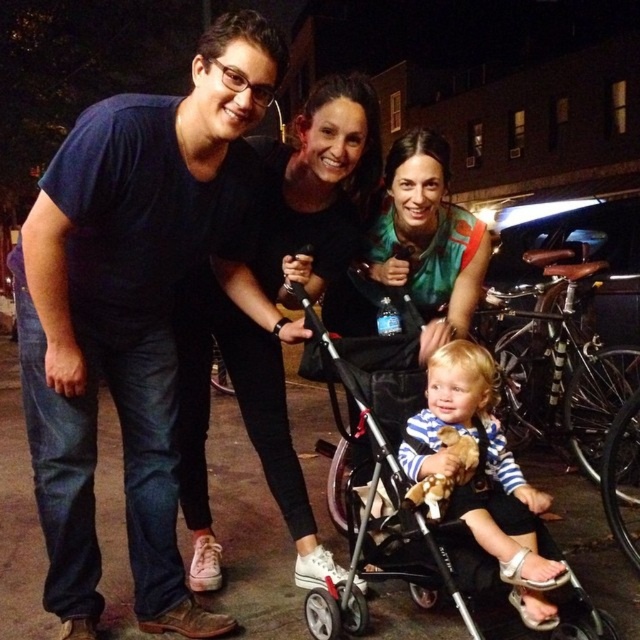
You are a photographer setting up for a group photo. You want to ensure the black matte sneakers at lower center and the striped fabric baby at center are both in focus. Which object should you adjust your focus on first to account for their sizes?

The striped fabric baby at center is smaller than the black matte sneakers at lower center, so you should focus on the striped fabric baby at center first to ensure its details are captured clearly.

You are a photographer trying to capture a clear shot of the striped fabric baby at center and the black matte sneakers at lower center. Which object should you focus on first if you want to ensure both are in focus?

The striped fabric baby at center should be focused on first because the black matte sneakers at lower center is taller, so adjusting focus from the taller object to the shorter one ensures both are in focus.